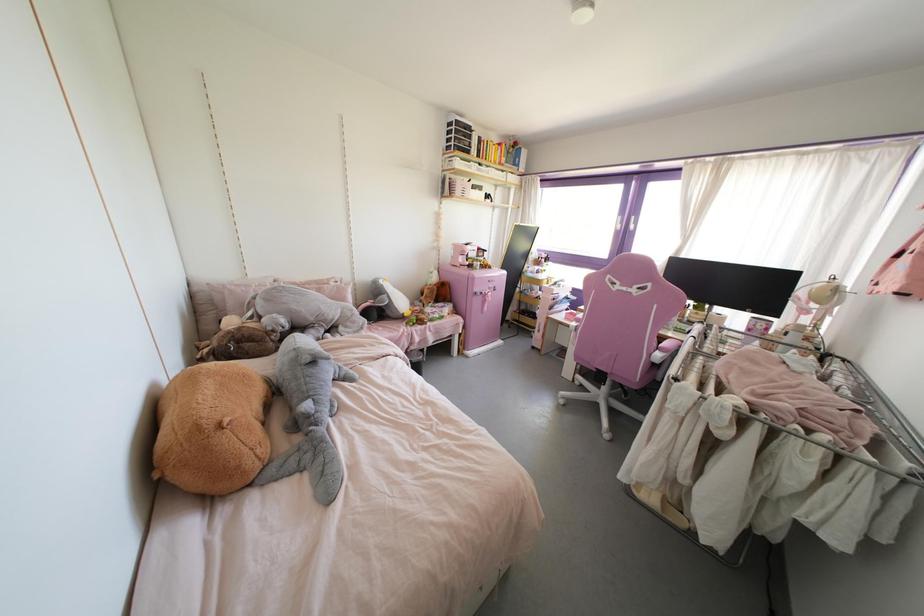
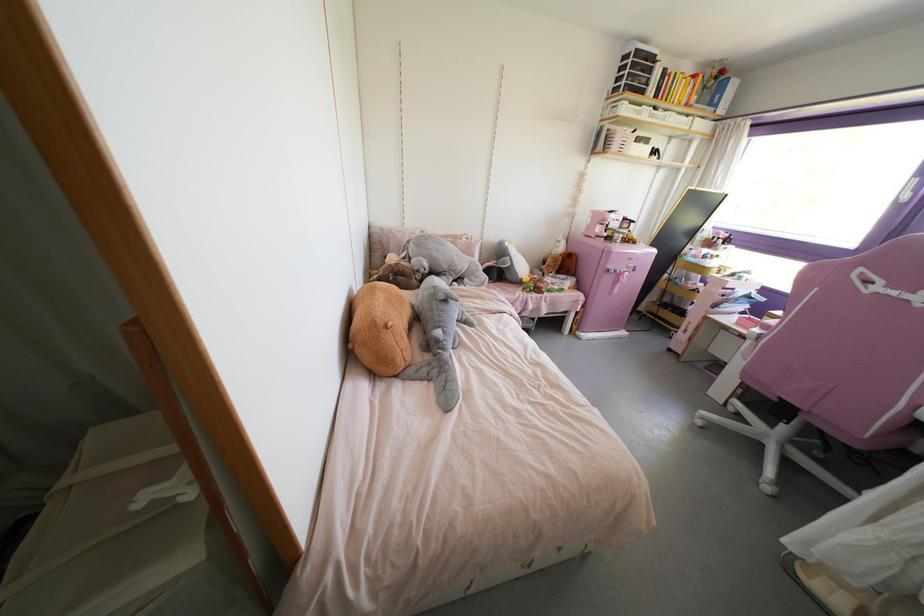
Where in the second image is the point corresponding to pixel 361 328 from the first image?

(482, 284)